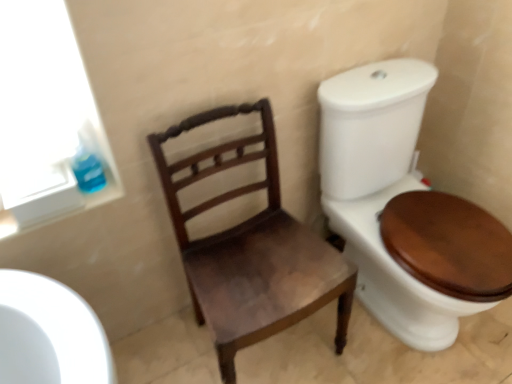
Question: Would you say blue glossy toilet paper at upper left is a long distance from mahogany wood chair at center?

Choices:
 (A) no
 (B) yes

Answer: (A)

Question: Does blue glossy toilet paper at upper left have a larger size compared to mahogany wood chair at center?

Choices:
 (A) no
 (B) yes

Answer: (A)

Question: Is blue glossy toilet paper at upper left aimed at mahogany wood chair at center?

Choices:
 (A) no
 (B) yes

Answer: (A)

Question: From a real-world perspective, is blue glossy toilet paper at upper left under mahogany wood chair at center?

Choices:
 (A) yes
 (B) no

Answer: (B)

Question: From the image's perspective, is blue glossy toilet paper at upper left on mahogany wood chair at center?

Choices:
 (A) yes
 (B) no

Answer: (A)

Question: Is blue glossy toilet paper at upper left wider than mahogany wood chair at center?

Choices:
 (A) no
 (B) yes

Answer: (A)

Question: From the image's perspective, is mahogany wood chair at center on blue glossy toilet paper at upper left?

Choices:
 (A) yes
 (B) no

Answer: (B)

Question: Can you confirm if mahogany wood chair at center is positioned to the right of blue glossy toilet paper at upper left?

Choices:
 (A) yes
 (B) no

Answer: (A)

Question: Is blue glossy toilet paper at upper left at the back of mahogany wood chair at center?

Choices:
 (A) no
 (B) yes

Answer: (A)

Question: Does mahogany wood chair at center turn towards blue glossy toilet paper at upper left?

Choices:
 (A) yes
 (B) no

Answer: (B)

Question: Considering the relative sizes of mahogany wood chair at center and blue glossy toilet paper at upper left in the image provided, is mahogany wood chair at center smaller than blue glossy toilet paper at upper left?

Choices:
 (A) yes
 (B) no

Answer: (B)

Question: From a real-world perspective, is mahogany wood chair at center located beneath blue glossy toilet paper at upper left?

Choices:
 (A) yes
 (B) no

Answer: (A)

Question: Looking at the image, does mahogany wood chair at center seem bigger or smaller compared to blue glossy toilet paper at upper left?

Choices:
 (A) big
 (B) small

Answer: (A)